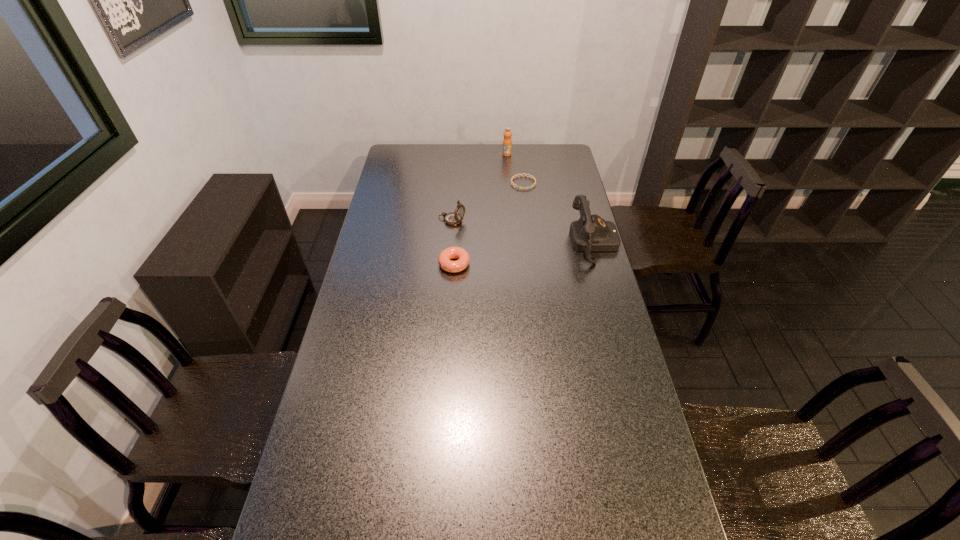
Find the location of a particular element. doughnut is located at coordinates (444, 260).

Identify the location of telephone. This screenshot has width=960, height=540. (590, 233).

This screenshot has height=540, width=960. I want to click on the farthest object, so click(507, 142).

You are a GUI agent. You are given a task and a screenshot of the screen. Output one action in this format:
    pyautogui.click(x=<x>, y=<y>)
    Task: Click on the orange juice
    
    Given the screenshot: What is the action you would take?
    pyautogui.click(x=507, y=142)

I want to click on the third shortest object, so click(453, 218).

Find the location of a particular element. the shortest object is located at coordinates (513, 177).

Find the location of a particular element. the second farthest object is located at coordinates (513, 177).

Where is `blank space located 0.270m on the right of the doughnut`? This screenshot has width=960, height=540. blank space located 0.270m on the right of the doughnut is located at coordinates (540, 265).

In order to click on vacant region located on the front label of the farthest object in this screenshot , I will do `click(512, 198)`.

Image resolution: width=960 pixels, height=540 pixels. What are the coordinates of `vacant space located 0.280m on the front label of the farthest object` in the screenshot? It's located at (511, 187).